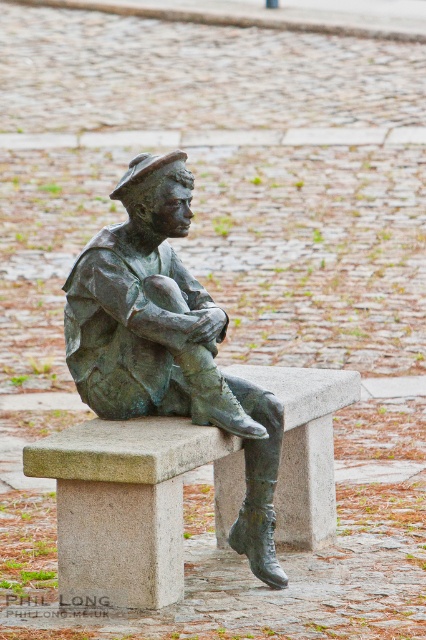
Question: Does granite bench at center appear under bronze statue at center?

Choices:
 (A) no
 (B) yes

Answer: (B)

Question: Is granite bench at center to the left of bronze statue at center from the viewer's perspective?

Choices:
 (A) no
 (B) yes

Answer: (B)

Question: Is granite bench at center to the right of bronze statue at center from the viewer's perspective?

Choices:
 (A) no
 (B) yes

Answer: (A)